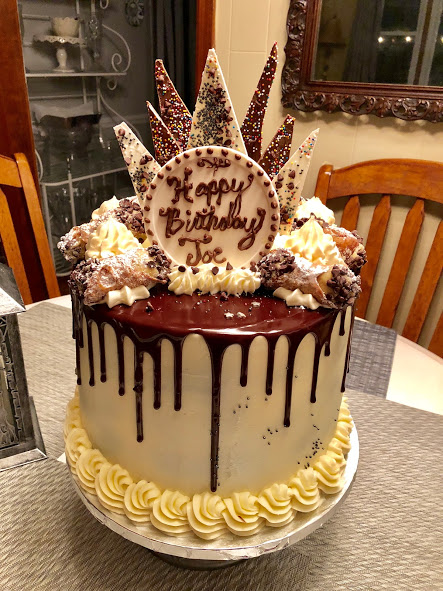
Where is `grey and white placemats`? Image resolution: width=443 pixels, height=591 pixels. grey and white placemats is located at coordinates (407, 519), (53, 551), (50, 391), (368, 357).